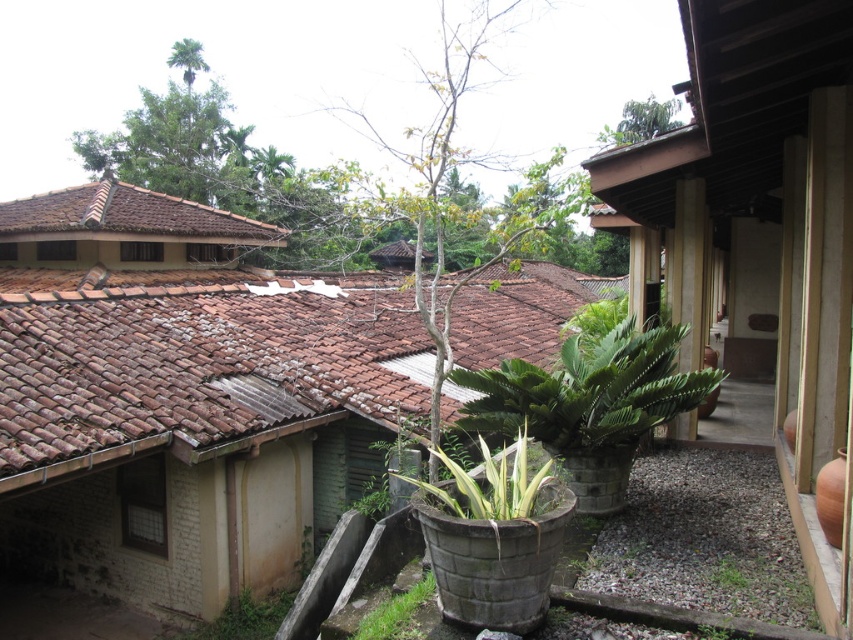
You are an architect designing a new building and want to incorporate elements from this scene. If you need to choose between replicating the brown clay tiles at upper left or the green leafy tree at center, which one would require more space due to its larger size?

The green leafy tree at center requires more space due to its larger size compared to the brown clay tiles at upper left.

You are standing in the garden and want to take a photo of the green leafy tree at center and the green leafy tree at upper center. Which tree is closer to the camera?

The green leafy tree at center is closer to the camera because it is positioned below the green leafy tree at upper center, indicating it is in front.

You are an architect designing a new building and want to ensure the roof tiles match the existing ones in the scene. Given that the brown clay tiles at upper left and the green leafy tree at upper center are both visible from your vantage point, which object would you focus on to determine the scale of the tiles?

The brown clay tiles at upper left are wider than the green leafy tree at upper center, so you should focus on the brown clay tiles at upper left to determine the scale since their width is greater than the tree.